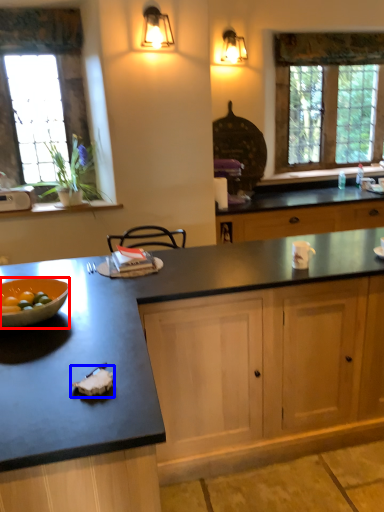
Question: Among these objects, which one is farthest to the camera, bowl (highlighted by a red box) or food (highlighted by a blue box)?

Choices:
 (A) bowl
 (B) food

Answer: (A)